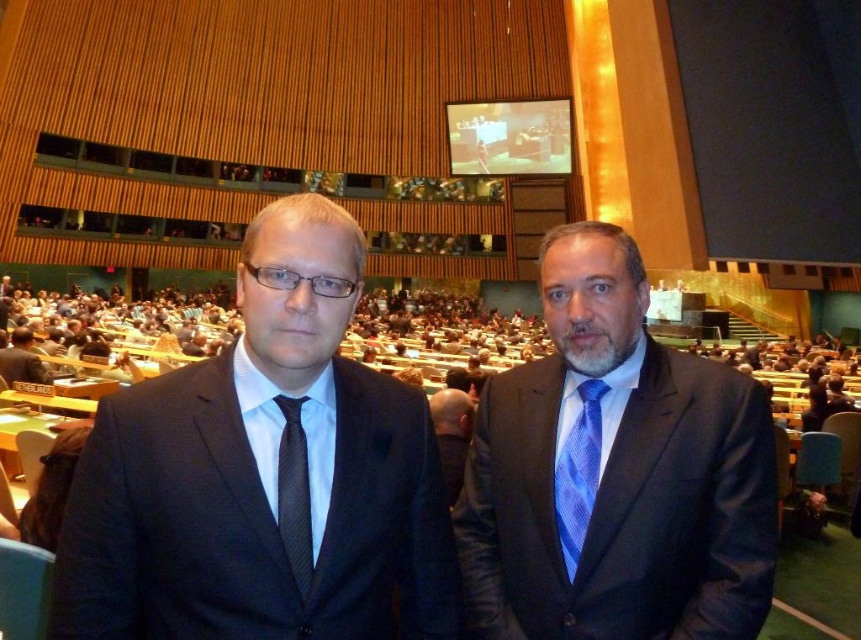
Question: Which is nearer to the blue woven tie at right?

Choices:
 (A) black textured tie at center
 (B) blue striped tie at center
 (C) matte black suit at center

Answer: (B)

Question: Can you confirm if matte black suit at center is smaller than blue striped tie at center?

Choices:
 (A) no
 (B) yes

Answer: (B)

Question: Is black textured tie at center to the left of matte black suit at left from the viewer's perspective?

Choices:
 (A) no
 (B) yes

Answer: (A)

Question: Does blue woven tie at right appear under black textured tie at center?

Choices:
 (A) yes
 (B) no

Answer: (A)

Question: Which object appears farthest from the camera in this image?

Choices:
 (A) blue silk tie at center
 (B) black textured tie at center

Answer: (A)

Question: Which of these objects is positioned closest to the blue striped tie at center?

Choices:
 (A) black textured tie at center
 (B) blue silk tie at center

Answer: (B)